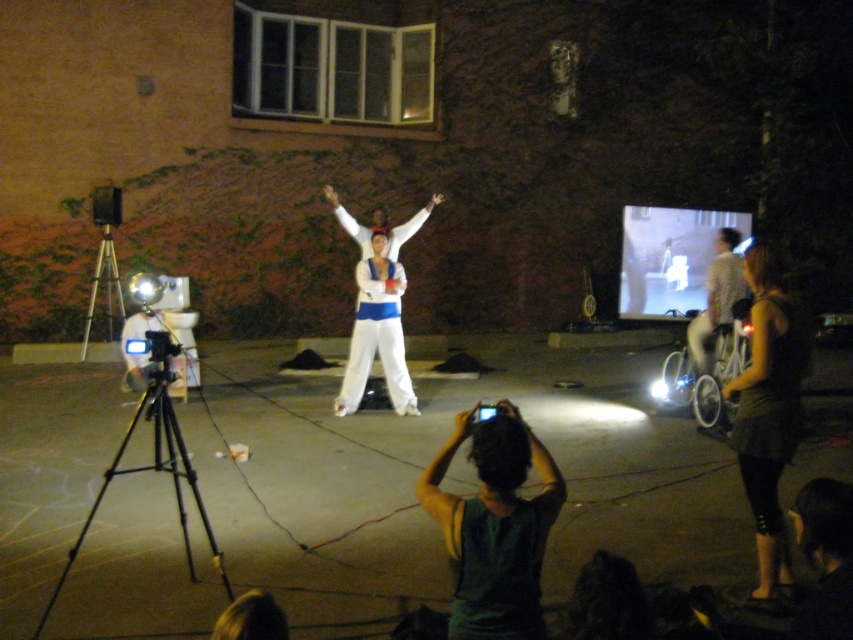
Between point (766, 410) and point (647, 285), which one is positioned in front?

Point (766, 410)

In order to click on dark green tank top at lower right in this screenshot , I will do `click(769, 410)`.

I want to click on dark green tank top at lower right, so pyautogui.click(x=769, y=410).

Which is above, white matte pants at center or silver metallic tripod at left?

silver metallic tripod at left

Find the location of a particular element. Image resolution: width=853 pixels, height=640 pixels. white matte pants at center is located at coordinates (376, 332).

Measure the distance between white matte pants at center and camera.

The distance of white matte pants at center from camera is 25.13 feet.

Find the location of a particular element. The width and height of the screenshot is (853, 640). white matte pants at center is located at coordinates (376, 332).

Which is below, matte white screen at center or black matte tripod at lower left?

Positioned lower is black matte tripod at lower left.

Can you confirm if matte white screen at center is wider than black matte tripod at lower left?

Yes, matte white screen at center is wider than black matte tripod at lower left.

From the picture: Measure the distance between matte white screen at center and camera.

matte white screen at center and camera are 12.91 meters apart.

Identify the location of matte white screen at center. (670, 257).